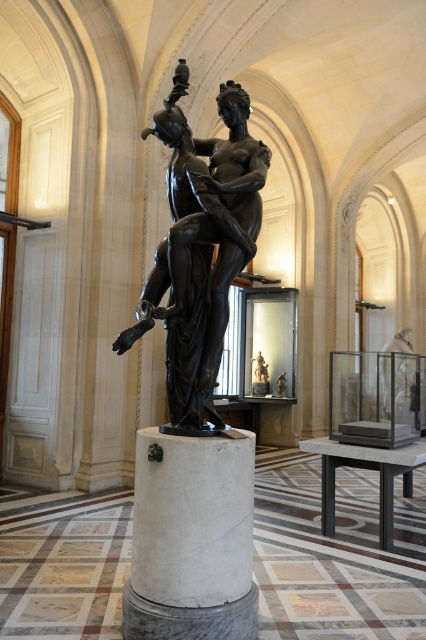
You are an art curator planning to install a new lighting system in the gallery. The bronze statue at center requires a spotlight that can cover its height, while the white marble pillar at center needs a smaller accent light. Based on the scene description, which object requires a spotlight with a larger coverage area?

The bronze statue at center requires a spotlight with a larger coverage area because it is much taller than the white marble pillar at center.

You are an art student standing in the museum and want to take a photo of the bronze statue at center and the white marble pillar at center. Which object is closer to you so that you can focus on it first?

→ The bronze statue at center is closer to you than the white marble pillar at center, so you can focus on it first.

You are an art curator planning to move the bronze statue at center to the left side of the white marble pillar at center. Based on their current positions, is this adjustment feasible without moving the pillar?

The bronze statue at center is currently to the right of the white marble pillar at center, so moving it to the left side of the pillar would require shifting its position relative to the pillar, which is feasible as long as there is enough space around them.